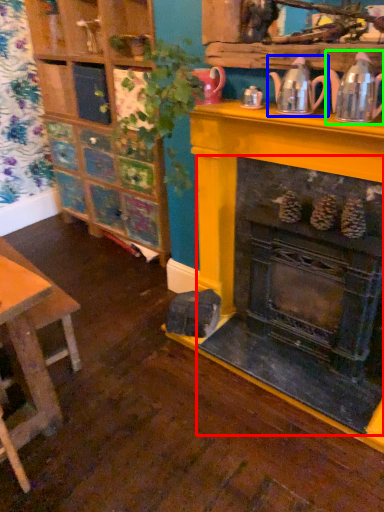
Question: Considering the real-world distances, which object is farthest from fireplace (highlighted by a red box)? tea pot (highlighted by a blue box) or tea pot (highlighted by a green box)?

Choices:
 (A) tea pot
 (B) tea pot

Answer: (A)